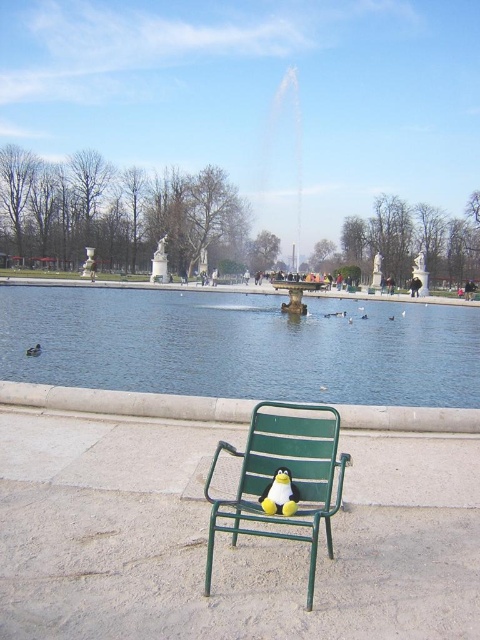
You are a visitor at the park and want to take a photo of both the green metal chair at center and the white matte duck at center without any obstruction. Based on their positions, which object should you focus on first to ensure both are in the frame?

The green metal chair at center is in front of the white matte duck at center, so you should focus on the white matte duck at center first to ensure both are visible without obstruction.